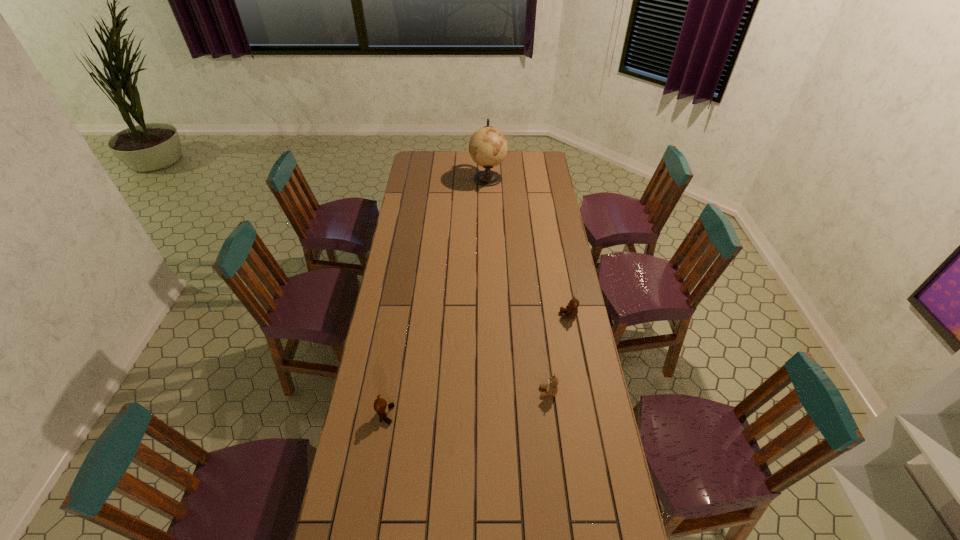
The width and height of the screenshot is (960, 540). Find the location of `free space at the far edge of the desktop`. free space at the far edge of the desktop is located at coordinates (500, 165).

At what (x,y) coordinates should I click in order to perform the action: click on vacant space at the left edge of the desktop. Please return your answer as a coordinate pair (x, y). Image resolution: width=960 pixels, height=540 pixels. Looking at the image, I should click on (410, 375).

You are a GUI agent. You are given a task and a screenshot of the screen. Output one action in this format:
    pyautogui.click(x=<x>, y=<y>)
    Task: Click on the vacant space at the right edge
    The width and height of the screenshot is (960, 540).
    Given the screenshot: What is the action you would take?
    [x=545, y=236]

I want to click on free space between the farthest object and the rightmost object, so click(x=528, y=247).

At what (x,y) coordinates should I click in order to perform the action: click on empty space between the second farthest object and the second farthest teddy bear. Please return your answer as a coordinate pair (x, y). The height and width of the screenshot is (540, 960). Looking at the image, I should click on (559, 353).

At what (x,y) coordinates should I click in order to perform the action: click on vacant space in between the globe and the second farthest object. Please return your answer as a coordinate pair (x, y). The height and width of the screenshot is (540, 960). Looking at the image, I should click on (528, 247).

This screenshot has width=960, height=540. Identify the location of free spot between the rightmost teddy bear and the second farthest teddy bear. (559, 353).

Where is `vacant space that's between the nearest object and the second teddy bear from left to right`? vacant space that's between the nearest object and the second teddy bear from left to right is located at coordinates (467, 403).

The image size is (960, 540). In order to click on vacant space that's between the leftmost object and the tallest object in this screenshot , I will do (x=437, y=296).

Find the location of a particular element. This screenshot has width=960, height=540. vacant region between the second object from right to left and the globe is located at coordinates (517, 285).